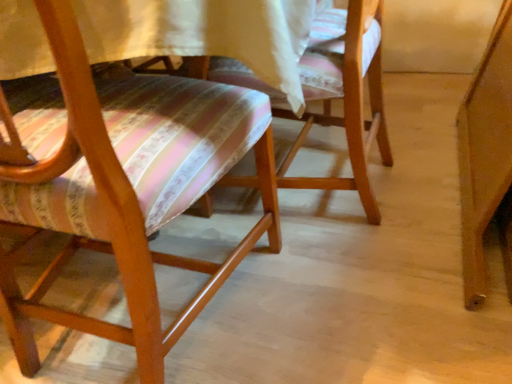
Question: Is wooden chair at center, the second chair viewed from the left, far away from wooden chair with striped cushion at left, the 2th chair in the right-to-left sequence?

Choices:
 (A) no
 (B) yes

Answer: (A)

Question: Is wooden chair at center, the second chair viewed from the left, with wooden chair with striped cushion at left, the 1th chair positioned from the left?

Choices:
 (A) no
 (B) yes

Answer: (A)

Question: Does wooden chair at center, the second chair viewed from the left, have a larger size compared to wooden chair with striped cushion at left, the 2th chair in the right-to-left sequence?

Choices:
 (A) yes
 (B) no

Answer: (B)

Question: Is wooden chair at center, acting as the 1th chair starting from the right, to the left of wooden chair with striped cushion at left, the 2th chair in the right-to-left sequence, from the viewer's perspective?

Choices:
 (A) no
 (B) yes

Answer: (A)

Question: Is wooden chair with striped cushion at left, the 2th chair in the right-to-left sequence, inside wooden chair at center, the second chair viewed from the left?

Choices:
 (A) no
 (B) yes

Answer: (A)

Question: Considering the relative sizes of wooden chair at center, the second chair viewed from the left, and wooden chair with striped cushion at left, the 2th chair in the right-to-left sequence, in the image provided, is wooden chair at center, the second chair viewed from the left, smaller than wooden chair with striped cushion at left, the 2th chair in the right-to-left sequence,?

Choices:
 (A) no
 (B) yes

Answer: (B)

Question: Considering the relative sizes of wooden chair with striped cushion at left, the 2th chair in the right-to-left sequence, and wooden chair at center, the second chair viewed from the left, in the image provided, is wooden chair with striped cushion at left, the 2th chair in the right-to-left sequence, shorter than wooden chair at center, the second chair viewed from the left,?

Choices:
 (A) yes
 (B) no

Answer: (B)

Question: Does wooden chair with striped cushion at left, the 1th chair positioned from the left, contain wooden chair at center, acting as the 1th chair starting from the right?

Choices:
 (A) yes
 (B) no

Answer: (B)

Question: From a real-world perspective, is wooden chair with striped cushion at left, the 2th chair in the right-to-left sequence, located higher than wooden chair at center, the second chair viewed from the left?

Choices:
 (A) yes
 (B) no

Answer: (A)

Question: From the image's perspective, is wooden chair with striped cushion at left, the 2th chair in the right-to-left sequence, under wooden chair at center, acting as the 1th chair starting from the right?

Choices:
 (A) yes
 (B) no

Answer: (A)

Question: Can you confirm if wooden chair with striped cushion at left, the 2th chair in the right-to-left sequence, is thinner than wooden chair at center, acting as the 1th chair starting from the right?

Choices:
 (A) yes
 (B) no

Answer: (B)

Question: Could you tell me if wooden chair with striped cushion at left, the 1th chair positioned from the left, is facing wooden chair at center, the second chair viewed from the left?

Choices:
 (A) no
 (B) yes

Answer: (B)

Question: Considering the positions of wooden chair at center, the second chair viewed from the left, and wooden chair with striped cushion at left, the 2th chair in the right-to-left sequence, in the image, is wooden chair at center, the second chair viewed from the left, bigger or smaller than wooden chair with striped cushion at left, the 2th chair in the right-to-left sequence,?

Choices:
 (A) small
 (B) big

Answer: (A)